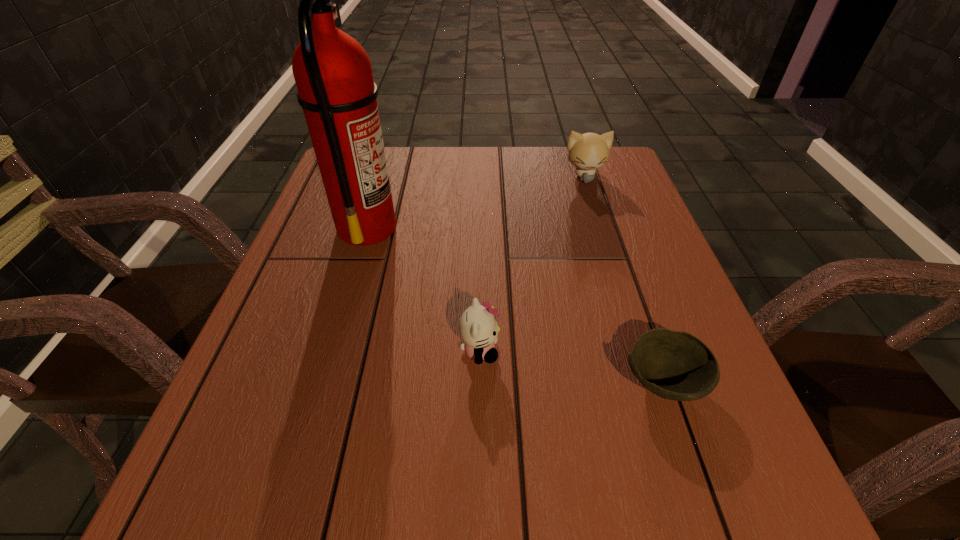
Find the location of `the tallest object`. the tallest object is located at coordinates (332, 71).

Find the location of a particular element. The image size is (960, 540). the second farthest object is located at coordinates (332, 71).

Where is `the farthest object`? This screenshot has width=960, height=540. the farthest object is located at coordinates (589, 151).

I want to click on the right kitten, so click(x=589, y=151).

At what (x,y) coordinates should I click in order to perform the action: click on the shorter kitten. Please return your answer as a coordinate pair (x, y). This screenshot has height=540, width=960. Looking at the image, I should click on (478, 328).

The height and width of the screenshot is (540, 960). In order to click on the second shortest object in this screenshot , I will do `click(478, 328)`.

Locate an element on the screen. the shortest object is located at coordinates (675, 365).

What are the coordinates of `free space located 0.200m on the side of the tallest object near the handle` in the screenshot? It's located at (484, 227).

Locate an element on the screen. The image size is (960, 540). vacant space located on the face of the right kitten is located at coordinates (597, 216).

Where is `vacant position located on the front-facing side of the second shortest object`? This screenshot has width=960, height=540. vacant position located on the front-facing side of the second shortest object is located at coordinates (682, 351).